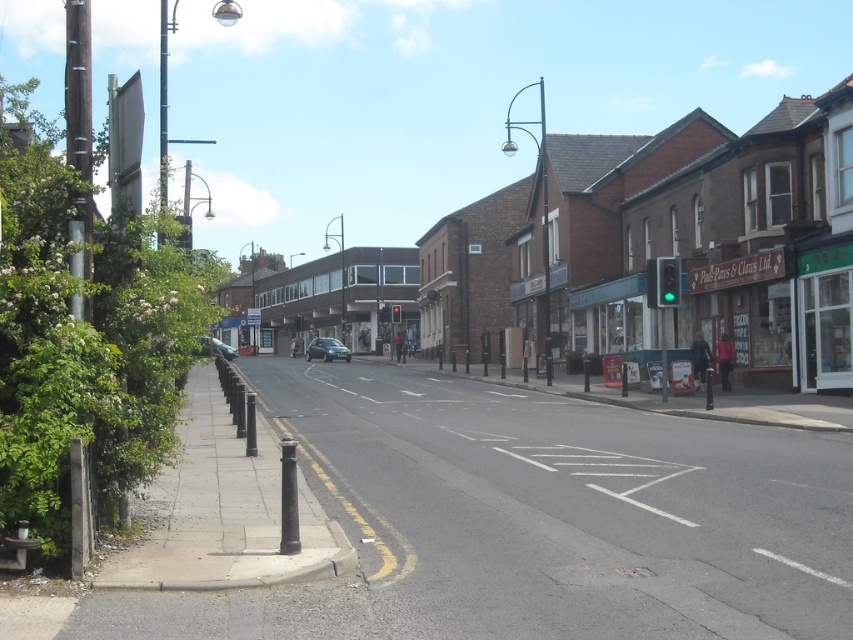
How much distance is there between shiny silver car at center and metallic silver car at center?

shiny silver car at center and metallic silver car at center are 8.38 meters apart.

Between shiny silver car at center and metallic silver car at center, which one is positioned higher?

shiny silver car at center

Does point (306, 349) come closer to viewer compared to point (196, 348)?

No, it is not.

Locate an element on the screen. shiny silver car at center is located at coordinates (328, 349).

Which of these two, dark brown glass building at center or shiny silver car at center, stands taller?

With more height is dark brown glass building at center.

Is dark brown glass building at center taller than shiny silver car at center?

Correct, dark brown glass building at center is much taller as shiny silver car at center.

Between point (293, 324) and point (310, 353), which one is positioned in front?

Positioned in front is point (310, 353).

Identify the location of dark brown glass building at center. This screenshot has height=640, width=853. (338, 298).

Locate an element on the screen. The image size is (853, 640). brown brick building at center is located at coordinates (664, 244).

In the scene shown: Is brown brick building at center behind shiny silver car at center?

No, brown brick building at center is in front of shiny silver car at center.

In order to click on brown brick building at center in this screenshot , I will do `click(664, 244)`.